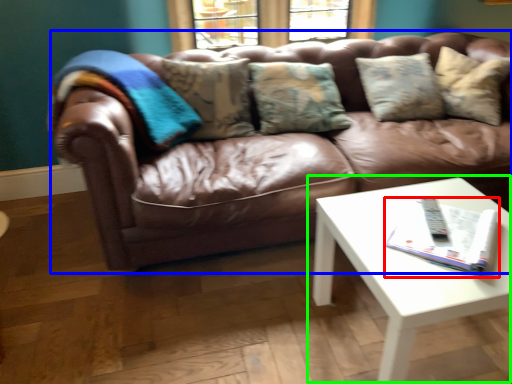
Question: Which is farther away from magazine (highlighted by a red box)? studio couch (highlighted by a blue box) or coffee table (highlighted by a green box)?

Choices:
 (A) studio couch
 (B) coffee table

Answer: (A)